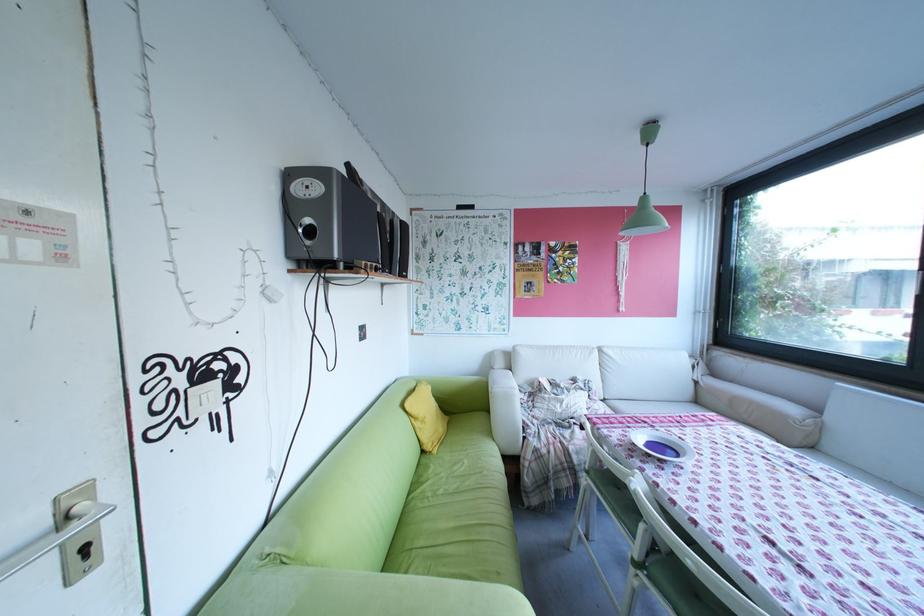
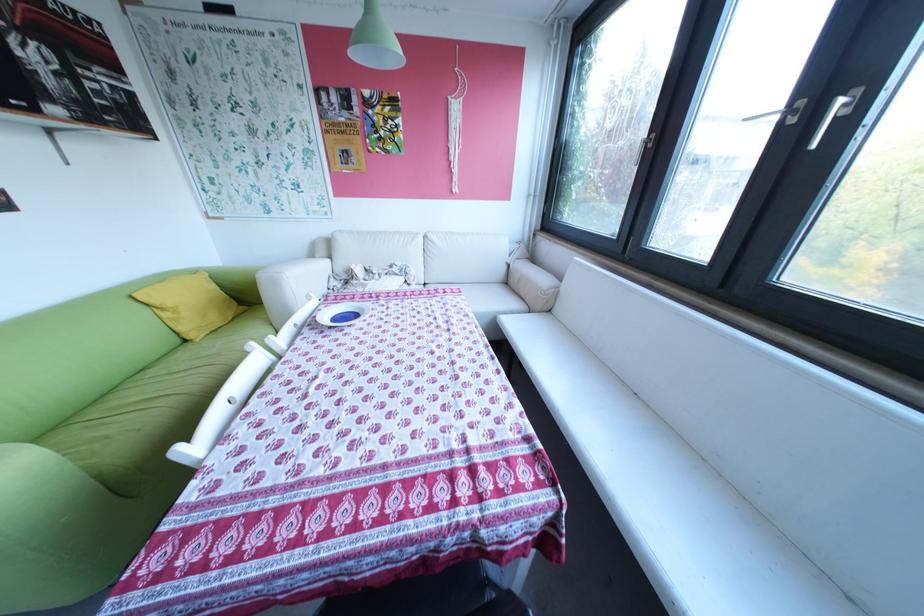
In the second image, find the point that corresponds to (521,398) in the first image.

(288, 283)